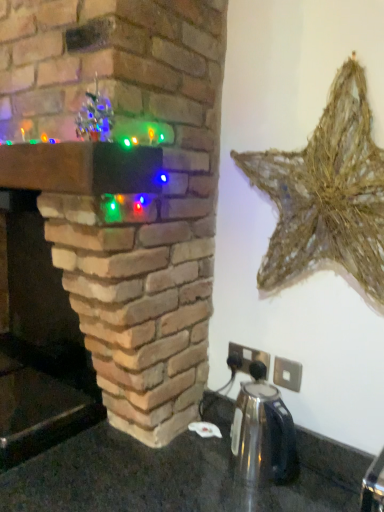
Image resolution: width=384 pixels, height=512 pixels. I want to click on rustic straw star at upper right, so click(x=326, y=194).

What are the coordinates of `brick fireplace at center` in the screenshot? It's located at (126, 188).

In order to click on rustic straw star at upper right in this screenshot , I will do `click(326, 194)`.

You are a GUI agent. You are given a task and a screenshot of the screen. Output one action in this format:
    pyautogui.click(x=<x>, y=<y>)
    Task: Click on the fireplace in front of the shiny metallic kettle at center
    
    Given the screenshot: What is the action you would take?
    pyautogui.click(x=126, y=188)

Is shiny metallic kettle at center positioned with its back to brick fireplace at center?

No.

Is shiny metallic kettle at center touching brick fireplace at center?

shiny metallic kettle at center is not next to brick fireplace at center, and they're not touching.

From the image's perspective, does shiny metallic kettle at center appear lower than rustic straw star at upper right?

Yes, from the image's perspective, shiny metallic kettle at center is beneath rustic straw star at upper right.

Between point (257, 444) and point (277, 224), which one is positioned in front?

The point (257, 444) is more forward.

Is shiny metallic kettle at center not near rustic straw star at upper right?

shiny metallic kettle at center is actually quite close to rustic straw star at upper right.

In the scene shown: Considering the sizes of objects shiny metallic kettle at center and rustic straw star at upper right in the image provided, who is thinner, shiny metallic kettle at center or rustic straw star at upper right?

rustic straw star at upper right is thinner.

Is rustic straw star at upper right oriented towards shiny metallic kettle at center?

No, rustic straw star at upper right is not aimed at shiny metallic kettle at center.

Is there a large distance between rustic straw star at upper right and shiny metallic kettle at center?

No, there isn't a large distance between rustic straw star at upper right and shiny metallic kettle at center.

Locate an element on the screen. star that appears above the shiny metallic kettle at center (from a real-world perspective) is located at coordinates (326, 194).

Can you confirm if brick fireplace at center is thinner than rustic straw star at upper right?

No.

Locate an element on the screen. Image resolution: width=384 pixels, height=512 pixels. star behind the brick fireplace at center is located at coordinates (326, 194).

Choose the correct answer: Is brick fireplace at center inside rustic straw star at upper right or outside it?

brick fireplace at center exists outside the volume of rustic straw star at upper right.

Where is `fireplace located above the shiny metallic kettle at center (from a real-world perspective)`? fireplace located above the shiny metallic kettle at center (from a real-world perspective) is located at coordinates (126, 188).

From a real-world perspective, is brick fireplace at center on top of shiny metallic kettle at center?

Correct, in the physical world, brick fireplace at center is higher than shiny metallic kettle at center.

Is brick fireplace at center located outside shiny metallic kettle at center?

brick fireplace at center lies outside shiny metallic kettle at center's area.

Is rustic straw star at upper right closer to the viewer compared to brick fireplace at center?

No, it is behind brick fireplace at center.

Which of these two, rustic straw star at upper right or brick fireplace at center, is wider?

brick fireplace at center.

Is rustic straw star at upper right outside of brick fireplace at center?

Yes.

In terms of size, does rustic straw star at upper right appear bigger or smaller than brick fireplace at center?

rustic straw star at upper right is smaller than brick fireplace at center.

In order to click on appliance below the brick fireplace at center (from the image's perspective) in this screenshot , I will do `click(263, 435)`.

The height and width of the screenshot is (512, 384). What are the coordinates of `appliance on the left of rustic straw star at upper right` in the screenshot? It's located at (263, 435).

Estimate the real-world distances between objects in this image. Which object is closer to brick fireplace at center, rustic straw star at upper right or shiny metallic kettle at center?

Based on the image, rustic straw star at upper right appears to be nearer to brick fireplace at center.

When comparing their distances from rustic straw star at upper right, does brick fireplace at center or shiny metallic kettle at center seem closer?

brick fireplace at center.

Based on their spatial positions, is shiny metallic kettle at center or brick fireplace at center further from rustic straw star at upper right?

The object further to rustic straw star at upper right is shiny metallic kettle at center.

Based on their spatial positions, is brick fireplace at center or rustic straw star at upper right further from shiny metallic kettle at center?

brick fireplace at center is positioned further to the anchor shiny metallic kettle at center.

Considering their positions, is shiny metallic kettle at center positioned closer to brick fireplace at center than rustic straw star at upper right?

Based on the image, rustic straw star at upper right appears to be nearer to brick fireplace at center.

Looking at the image, which one is located further to shiny metallic kettle at center, rustic straw star at upper right or brick fireplace at center?

brick fireplace at center.

Locate an element on the screen. This screenshot has width=384, height=512. appliance between brick fireplace at center and rustic straw star at upper right in the horizontal direction is located at coordinates (263, 435).